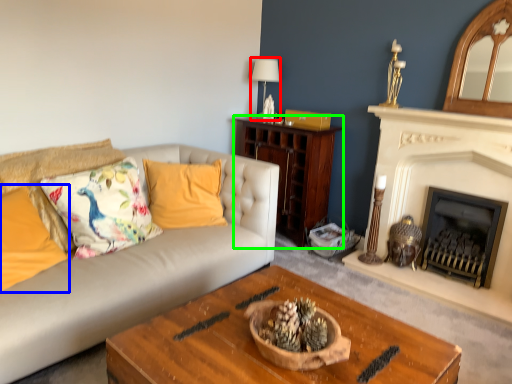
Question: Which is nearer to the lamp (highlighted by a red box)? pillow (highlighted by a blue box) or cabinetry (highlighted by a green box).

Choices:
 (A) pillow
 (B) cabinetry

Answer: (B)